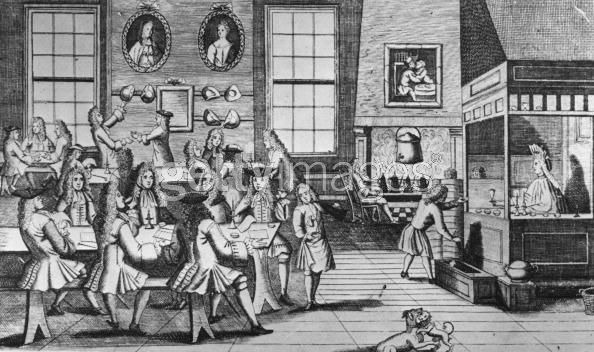
Find the location of `windows`. windows is located at coordinates (305, 46), (307, 113), (64, 47), (52, 113).